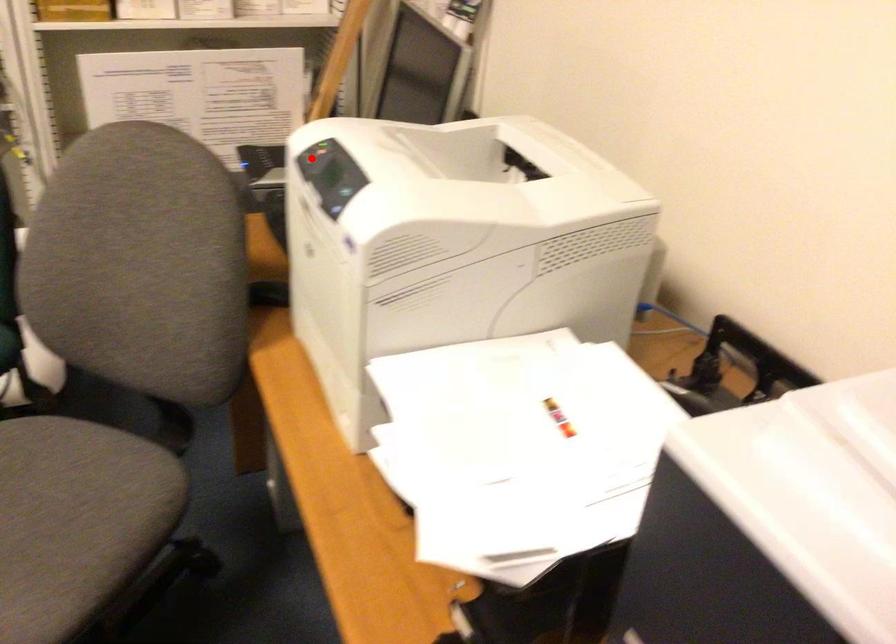
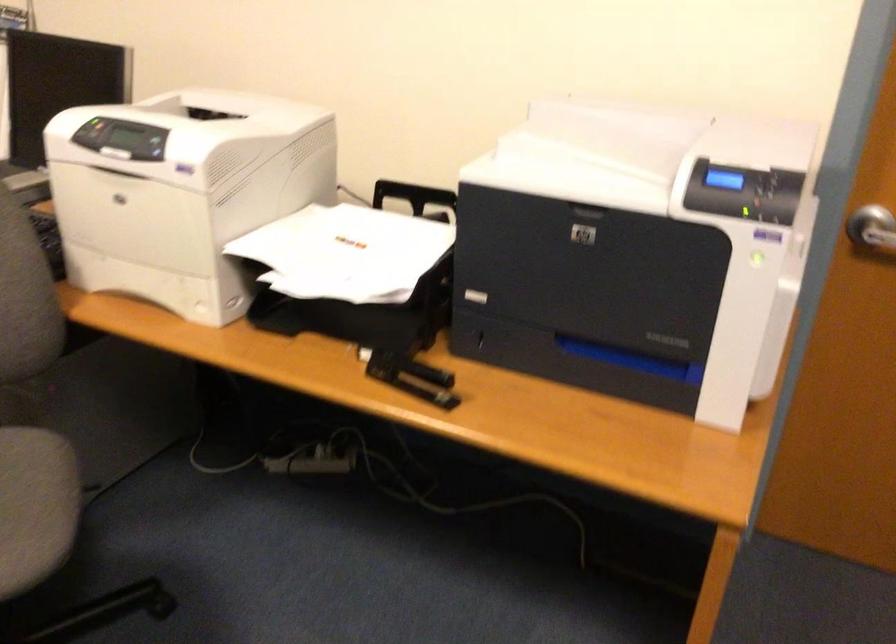
Question: I am providing you with two images of the same scene from different viewpoints. Image1 has a red point marked. In image2, the corresponding 3D location appears at what relative position? Reply with the corresponding letter.

Choices:
 (A) Closer
 (B) Farther

Answer: (B)